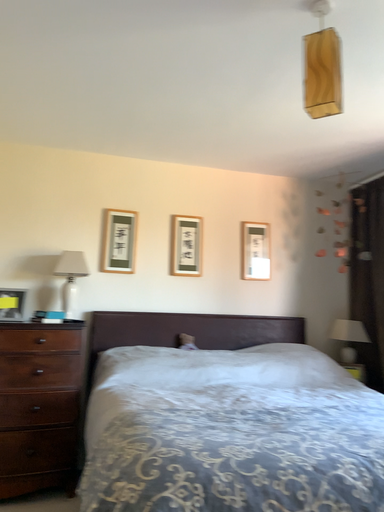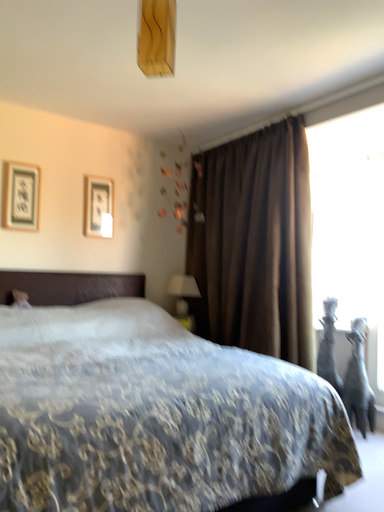
Question: Which way did the camera rotate in the video?

Choices:
 (A) rotated downward
 (B) rotated upward

Answer: (A)